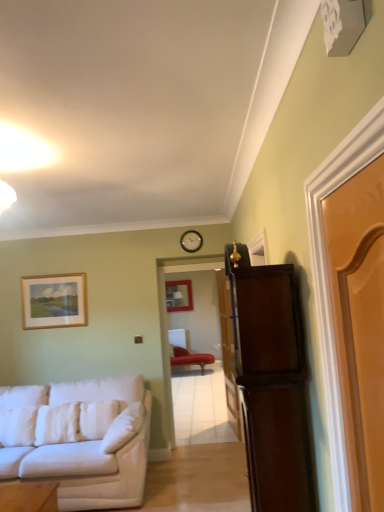
Locate an element on the screen. This screenshot has width=384, height=512. white soft pillow at lower left, which ranks as the first pillow in left-to-right order is located at coordinates (57, 424).

Describe the element at coordinates (57, 424) in the screenshot. This screenshot has width=384, height=512. I see `white soft pillow at lower left, arranged as the third pillow when viewed from the right` at that location.

Image resolution: width=384 pixels, height=512 pixels. I want to click on white fabric couch at left, so click(79, 439).

Describe the element at coordinates (359, 323) in the screenshot. I see `light brown wooden door at right, arranged as the third door when viewed from the back` at that location.

What do you see at coordinates (54, 301) in the screenshot?
I see `wooden picture frame at upper left, which is the 2th picture frame from back to front` at bounding box center [54, 301].

The image size is (384, 512). What do you see at coordinates (179, 295) in the screenshot? I see `matte wooden picture frame at center, the first picture frame when ordered from right to left` at bounding box center [179, 295].

The height and width of the screenshot is (512, 384). I want to click on white soft pillow at lower left, which ranks as the first pillow in left-to-right order, so click(57, 424).

From a real-world perspective, between metallic round clock at upper center and dark wood cabinet at right, who is vertically higher?

In real-world perspective, metallic round clock at upper center is above.

Considering the positions of point (190, 243) and point (287, 456), is point (190, 243) closer or farther from the camera than point (287, 456)?

Point (190, 243).

Could you tell me if metallic round clock at upper center is facing dark wood cabinet at right?

Yes, metallic round clock at upper center is oriented towards dark wood cabinet at right.

Consider the image. Can you tell me how much metallic round clock at upper center and dark wood cabinet at right differ in facing direction?

The angle between the facing direction of metallic round clock at upper center and the facing direction of dark wood cabinet at right is 89.1 degrees.

Which is in front, white soft pillow at lower left, arranged as the third pillow when viewed from the right, or wooden door at center, which is the 2th door in back-to-front order?

white soft pillow at lower left, arranged as the third pillow when viewed from the right, is closer to the camera.

Can wooden door at center, which is the 2th door in back-to-front order, be found inside white soft pillow at lower left, arranged as the third pillow when viewed from the right?

Actually, wooden door at center, which is the 2th door in back-to-front order, is outside white soft pillow at lower left, arranged as the third pillow when viewed from the right.

From a real-world perspective, between white soft pillow at lower left, arranged as the third pillow when viewed from the right, and wooden door at center, which ranks as the 2th door in front-to-back order, who is vertically higher?

wooden door at center, which ranks as the 2th door in front-to-back order, from a real-world perspective.

From the image's perspective, is white soft pillow at lower left, which ranks as the first pillow in left-to-right order, above or below wooden door at center, which ranks as the 2th door in front-to-back order?

Clearly, from the image's perspective, white soft pillow at lower left, which ranks as the first pillow in left-to-right order, is below wooden door at center, which ranks as the 2th door in front-to-back order.

Is white soft pillow at lower left, the second pillow when ordered from right to left, positioned with its back to wooden door at center, placed as the 3th door when sorted from front to back?

No, white soft pillow at lower left, the second pillow when ordered from right to left, is not facing away from wooden door at center, placed as the 3th door when sorted from front to back.

Who is more distant, white soft pillow at lower left, the second pillow when ordered from right to left, or wooden door at center, placed as the 3th door when sorted from front to back?

wooden door at center, placed as the 3th door when sorted from front to back, is more distant.

Looking at this image, are white soft pillow at lower left, positioned as the second pillow in left-to-right order, and wooden door at center, which is the 1th door from back to front, beside each other?

No, white soft pillow at lower left, positioned as the second pillow in left-to-right order, is not beside wooden door at center, which is the 1th door from back to front.

How different are the orientations of white soft pillow at lower left, the second pillow when ordered from right to left, and wooden door at center, placed as the 3th door when sorted from front to back, in degrees?

79.4 degrees.

I want to click on pillow that is the 3rd object to the left of the wooden door at center, which is the 1th door from back to front, starting at the anchor, so click(57, 424).

Can you tell me how much white soft pillow at lower left, which ranks as the first pillow in left-to-right order, and wooden door at center, placed as the 3th door when sorted from front to back, differ in facing direction?

The facing directions of white soft pillow at lower left, which ranks as the first pillow in left-to-right order, and wooden door at center, placed as the 3th door when sorted from front to back, are 85.4 degrees apart.

Does white soft pillow at lower left, which ranks as the first pillow in left-to-right order, touch wooden door at center, placed as the 3th door when sorted from front to back?

white soft pillow at lower left, which ranks as the first pillow in left-to-right order, and wooden door at center, placed as the 3th door when sorted from front to back, are not in contact.

Looking at the image, does white soft pillow at lower left, which ranks as the first pillow in left-to-right order, seem bigger or smaller compared to wooden door at center, which is the 1th door from back to front?

Considering their sizes, white soft pillow at lower left, which ranks as the first pillow in left-to-right order, takes up less space than wooden door at center, which is the 1th door from back to front.

Measure the distance from dark wood cabinet at right to light brown wooden door at right, arranged as the third door when viewed from the back.

dark wood cabinet at right and light brown wooden door at right, arranged as the third door when viewed from the back, are 19.48 inches apart from each other.

How different are the orientations of dark wood cabinet at right and light brown wooden door at right, which is counted as the first door, starting from the front, in degrees?

dark wood cabinet at right and light brown wooden door at right, which is counted as the first door, starting from the front, are facing 2.72 degrees away from each other.

In the scene shown: Who is smaller, dark wood cabinet at right or light brown wooden door at right, which is counted as the first door, starting from the front?

With smaller size is light brown wooden door at right, which is counted as the first door, starting from the front.

Is dark wood cabinet at right positioned in front of light brown wooden door at right, arranged as the third door when viewed from the back?

No, dark wood cabinet at right is behind light brown wooden door at right, arranged as the third door when viewed from the back.

You are a GUI agent. You are given a task and a screenshot of the screen. Output one action in this format:
    pyautogui.click(x=<x>, y=<y>)
    Task: Click on the cabinetry above the white soft pillow at lower left, the second pillow when ordered from right to left (from a real-world perspective)
    
    Given the screenshot: What is the action you would take?
    pyautogui.click(x=271, y=383)

Can you confirm if white soft pillow at lower left, positioned as the second pillow in left-to-right order, is thinner than dark wood cabinet at right?

Yes.

Which object is more forward, white soft pillow at lower left, the second pillow when ordered from right to left, or dark wood cabinet at right?

Positioned in front is dark wood cabinet at right.

What's the angular difference between white soft pillow at lower left, positioned as the second pillow in left-to-right order, and dark wood cabinet at right's facing directions?

The facing directions of white soft pillow at lower left, positioned as the second pillow in left-to-right order, and dark wood cabinet at right are 85 degrees apart.

From a real-world perspective, is dark wood cabinet at right above or below velvet red chaise at center?

Clearly, from a real-world perspective, dark wood cabinet at right is above velvet red chaise at center.

From the image's perspective, which one is positioned lower, dark wood cabinet at right or velvet red chaise at center?

velvet red chaise at center, from the image's perspective.

Based on their positions, is dark wood cabinet at right located to the left or right of velvet red chaise at center?

In the image, dark wood cabinet at right appears on the right side of velvet red chaise at center.

Where is `cabinetry that is below the metallic round clock at upper center (from the image's perspective)`? The height and width of the screenshot is (512, 384). cabinetry that is below the metallic round clock at upper center (from the image's perspective) is located at coordinates (271, 383).

The width and height of the screenshot is (384, 512). In order to click on pillow that is the 2nd object directly below the wooden door at center, which is the 2th door in back-to-front order (from a real-world perspective) in this screenshot , I will do `click(57, 424)`.

From the image, which object appears to be nearer to matte wooden picture frame at center, arranged as the second picture frame when viewed from the front, white fabric couch at left or velvet red chaise at center?

velvet red chaise at center lies closer to matte wooden picture frame at center, arranged as the second picture frame when viewed from the front, than the other object.

From the image, which object appears to be farther from matte wooden picture frame at center, which is counted as the 1th picture frame, starting from the back, dark wood cabinet at right or white fabric couch at left?

Based on the image, dark wood cabinet at right appears to be further to matte wooden picture frame at center, which is counted as the 1th picture frame, starting from the back.

Considering their positions, is white fabric couch at left positioned further to wooden picture frame at upper left, the first picture frame viewed from the left, than wooden door at center, which ranks as the 2th door in front-to-back order?

wooden door at center, which ranks as the 2th door in front-to-back order, is further to wooden picture frame at upper left, the first picture frame viewed from the left.

Estimate the real-world distances between objects in this image. Which object is closer to wooden picture frame at upper left, the first picture frame viewed from the left, dark wood cabinet at right or white fabric couch at left?

Among the two, white fabric couch at left is located nearer to wooden picture frame at upper left, the first picture frame viewed from the left.

From the picture: From the image, which object appears to be nearer to matte wooden picture frame at center, which is counted as the 1th picture frame, starting from the back, white soft pillow at lower left, arranged as the third pillow when viewed from the right, or wooden door at center, which is the 1th door from back to front?

wooden door at center, which is the 1th door from back to front.

From the image, which object appears to be farther from white fabric couch at left, velvet red chaise at center or wooden picture frame at upper left, placed as the 2th picture frame when sorted from right to left?

Among the two, velvet red chaise at center is located further to white fabric couch at left.

Considering their positions, is wooden door at center, which is the 2th door in back-to-front order, positioned further to light brown wooden door at right, arranged as the third door when viewed from the back, than dark wood cabinet at right?

wooden door at center, which is the 2th door in back-to-front order, is further to light brown wooden door at right, arranged as the third door when viewed from the back.

From the image, which object appears to be nearer to white soft pillow at lower left, marked as the 1th pillow in a right-to-left arrangement, wooden picture frame at upper left, the first picture frame viewed from the left, or metallic round clock at upper center?

wooden picture frame at upper left, the first picture frame viewed from the left, lies closer to white soft pillow at lower left, marked as the 1th pillow in a right-to-left arrangement, than the other object.

At what (x,y) coordinates should I click in order to perform the action: click on chair positioned between wooden picture frame at upper left, the first picture frame viewed from the left, and matte wooden picture frame at center, which is the second picture frame in left-to-right order, from near to far. Please return your answer as a coordinate pair (x, y). The height and width of the screenshot is (512, 384). Looking at the image, I should click on (190, 358).

Find the location of a particular element. picture frame between white fabric couch at left and matte wooden picture frame at center, which is the second picture frame in left-to-right order, from front to back is located at coordinates (54, 301).

Find the location of a particular element. Image resolution: width=384 pixels, height=512 pixels. pillow located between light brown wooden door at right, arranged as the third door when viewed from the back, and white soft pillow at lower left, which ranks as the first pillow in left-to-right order, in the depth direction is located at coordinates (123, 428).

Where is `clock situated between wooden picture frame at upper left, placed as the 2th picture frame when sorted from right to left, and wooden door at center, which is the 1th door from back to front, from left to right`? The width and height of the screenshot is (384, 512). clock situated between wooden picture frame at upper left, placed as the 2th picture frame when sorted from right to left, and wooden door at center, which is the 1th door from back to front, from left to right is located at coordinates (191, 241).